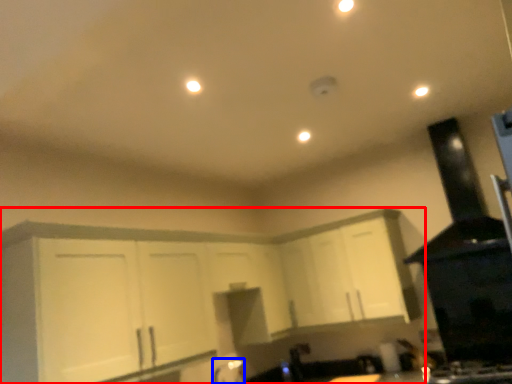
Question: Which object is closer to the camera taking this photo, cabinetry (highlighted by a red box) or faucet (highlighted by a blue box)?

Choices:
 (A) cabinetry
 (B) faucet

Answer: (A)